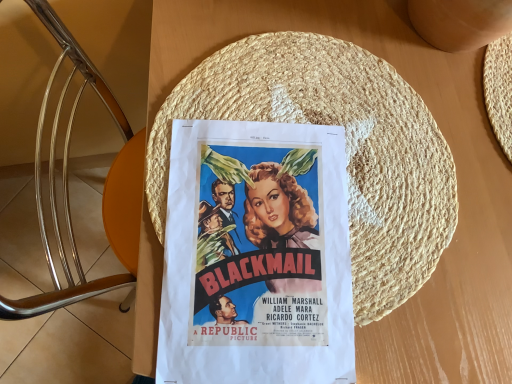
At what (x,y) coordinates should I click in order to perform the action: click on free space above woven straw hat at center (from a real-world perspective). Please return your answer as a coordinate pair (x, y). Looking at the image, I should click on (310, 177).